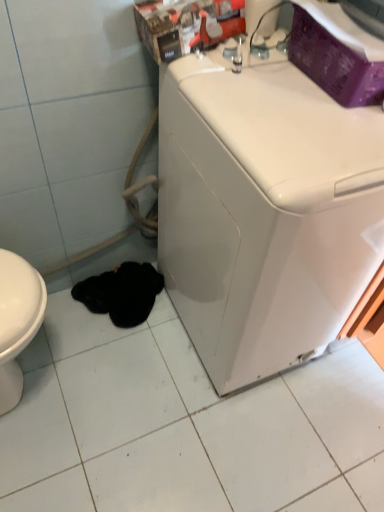
Find the location of a particular element. The image size is (384, 512). white glossy washing machine at center is located at coordinates (264, 212).

The height and width of the screenshot is (512, 384). What do you see at coordinates (264, 212) in the screenshot? I see `white glossy washing machine at center` at bounding box center [264, 212].

What do you see at coordinates (121, 293) in the screenshot? The image size is (384, 512). I see `black soft cloth at lower left` at bounding box center [121, 293].

Identify the location of black soft cloth at lower left. The image size is (384, 512). (121, 293).

You are a GUI agent. You are given a task and a screenshot of the screen. Output one action in this format:
    pyautogui.click(x=<x>, y=<y>)
    Task: Click on the white glossy washing machine at center
    The image size is (384, 512).
    Given the screenshot: What is the action you would take?
    pyautogui.click(x=264, y=212)

Which is more to the left, black soft cloth at lower left or white glossy washing machine at center?

black soft cloth at lower left is more to the left.

Is black soft cloth at lower left further to camera compared to white glossy washing machine at center?

That is True.

Is point (146, 311) closer to camera compared to point (361, 111)?

That is False.

From the image's perspective, which object appears higher, black soft cloth at lower left or white glossy washing machine at center?

white glossy washing machine at center is shown above in the image.

From a real-world perspective, is black soft cloth at lower left physically located above or below white glossy washing machine at center?

In terms of real-world spatial position, black soft cloth at lower left is below white glossy washing machine at center.

Considering the relative sizes of black soft cloth at lower left and white glossy washing machine at center in the image provided, is black soft cloth at lower left thinner than white glossy washing machine at center?

Yes.

Is black soft cloth at lower left taller than white glossy washing machine at center?

In fact, black soft cloth at lower left may be shorter than white glossy washing machine at center.

Considering the sizes of objects black soft cloth at lower left and white glossy washing machine at center in the image provided, who is bigger, black soft cloth at lower left or white glossy washing machine at center?

white glossy washing machine at center is bigger.

Is black soft cloth at lower left completely or partially outside of white glossy washing machine at center?

Absolutely, black soft cloth at lower left is external to white glossy washing machine at center.

Consider the image. Is there a large distance between black soft cloth at lower left and white glossy washing machine at center?

black soft cloth at lower left is near white glossy washing machine at center, not far away.

Is black soft cloth at lower left facing away from white glossy washing machine at center?

That's not correct — black soft cloth at lower left is not looking away from white glossy washing machine at center.

This screenshot has height=512, width=384. In order to click on animal below the white glossy washing machine at center (from a real-world perspective) in this screenshot , I will do `click(121, 293)`.

Would you say white glossy washing machine at center is to the left or to the right of black soft cloth at lower left in the picture?

Based on their positions, white glossy washing machine at center is located to the right of black soft cloth at lower left.

Which object is further away from the camera, white glossy washing machine at center or black soft cloth at lower left?

black soft cloth at lower left is behind.

Is point (229, 170) positioned in front of point (159, 276)?

Yes, point (229, 170) is in front of point (159, 276).

From the image's perspective, is white glossy washing machine at center over black soft cloth at lower left?

Yes, from the image's perspective, white glossy washing machine at center is above black soft cloth at lower left.

From a real-world perspective, which object rests below the other?

A: black soft cloth at lower left.

In terms of width, does white glossy washing machine at center look wider or thinner when compared to black soft cloth at lower left?

Clearly, white glossy washing machine at center has more width compared to black soft cloth at lower left.

Can you confirm if white glossy washing machine at center is shorter than black soft cloth at lower left?

In fact, white glossy washing machine at center may be taller than black soft cloth at lower left.

Between white glossy washing machine at center and black soft cloth at lower left, which one has larger size?

Bigger between the two is white glossy washing machine at center.

Would you say white glossy washing machine at center is outside black soft cloth at lower left?

white glossy washing machine at center is positioned outside black soft cloth at lower left.

Is white glossy washing machine at center far away from black soft cloth at lower left?

Actually, white glossy washing machine at center and black soft cloth at lower left are a little close together.

Could you tell me if white glossy washing machine at center is turned towards black soft cloth at lower left?

No, white glossy washing machine at center is not aimed at black soft cloth at lower left.

The image size is (384, 512). I want to click on animal behind the white glossy washing machine at center, so click(x=121, y=293).

In the image, there is a white glossy washing machine at center. Identify the location of animal below it (from a real-world perspective). The height and width of the screenshot is (512, 384). (121, 293).

This screenshot has height=512, width=384. What are the coordinates of `animal behind the white glossy washing machine at center` in the screenshot? It's located at (121, 293).